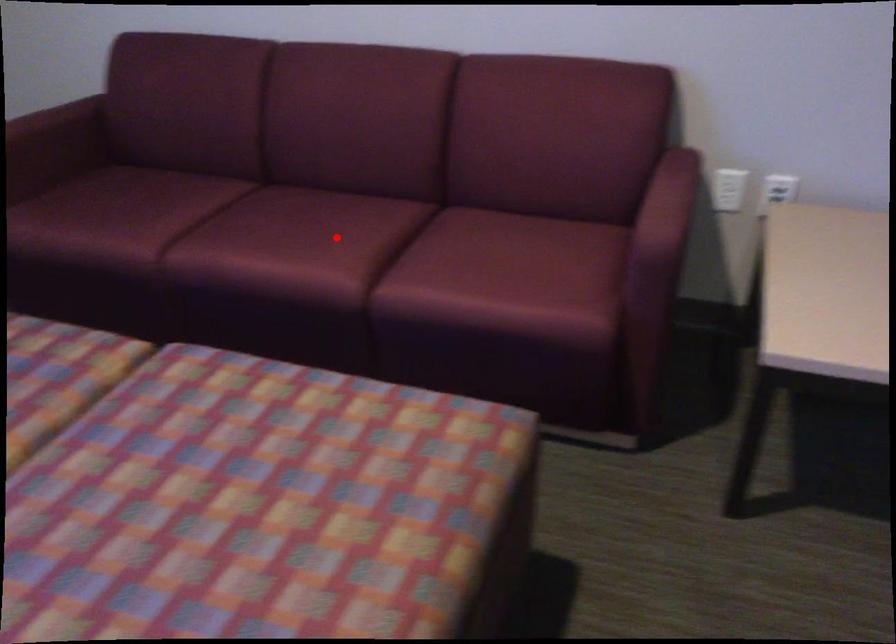
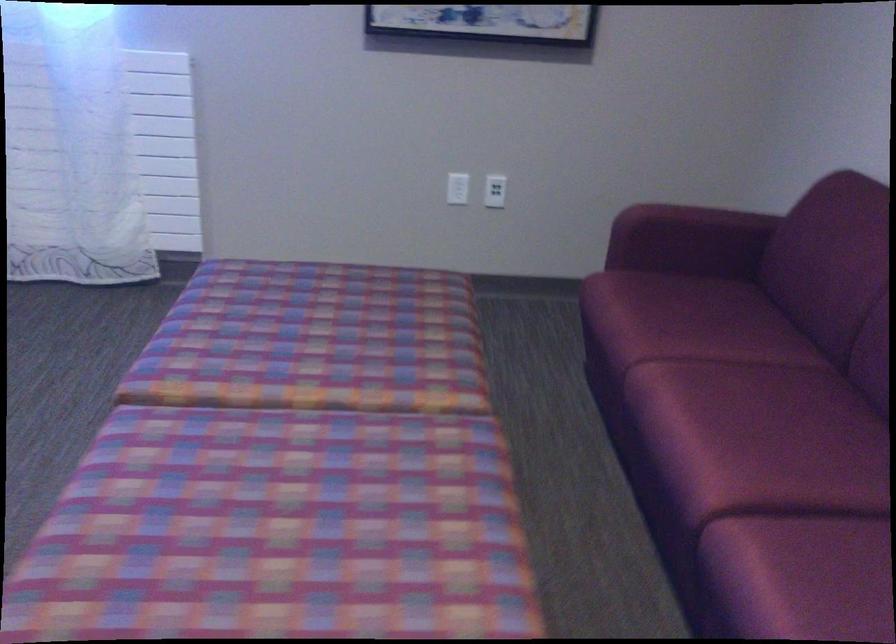
Question: A red point is marked in image1. In image2, is the corresponding 3D point closer to the camera or farther? Reply with the corresponding letter.

Choices:
 (A) The corresponding 3D point is closer.
 (B) The corresponding 3D point is farther.

Answer: (A)